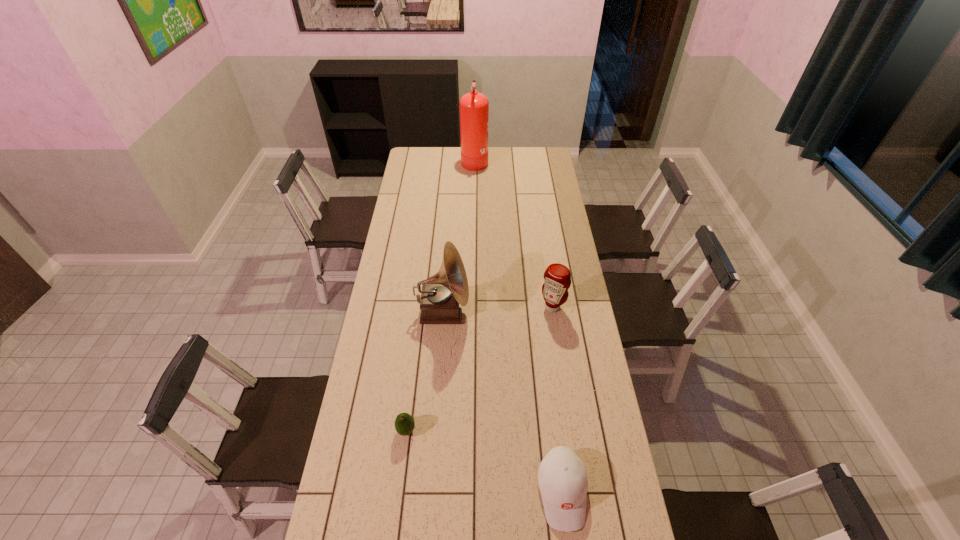
In order to click on object present at the far edge in this screenshot , I will do `click(474, 107)`.

Locate an element on the screen. Image resolution: width=960 pixels, height=540 pixels. object situated at the left edge is located at coordinates (404, 423).

Where is `condiment that is at the right edge`? This screenshot has width=960, height=540. condiment that is at the right edge is located at coordinates (557, 278).

You are a GUI agent. You are given a task and a screenshot of the screen. Output one action in this format:
    pyautogui.click(x=<x>, y=<y>)
    Task: Click on the baseball cap located in the right edge section of the desktop
    This screenshot has width=960, height=540.
    Given the screenshot: What is the action you would take?
    pyautogui.click(x=562, y=478)

In the image, there is a desktop. Where is `free space at the left edge`? This screenshot has width=960, height=540. free space at the left edge is located at coordinates (407, 289).

At what (x,y) coordinates should I click in order to perform the action: click on free point at the right edge. Please return your answer as a coordinate pair (x, y). Looking at the image, I should click on (573, 284).

Locate an element on the screen. Image resolution: width=960 pixels, height=540 pixels. vacant space at the far right corner of the desktop is located at coordinates (553, 165).

Find the location of a particular element. Image resolution: width=960 pixels, height=540 pixels. free space between the nearest object and the fourth shortest object is located at coordinates (502, 402).

Identify the location of empty location between the phonograph record and the second nearest object. The width and height of the screenshot is (960, 540). (424, 371).

Identify the location of free space between the second nearest object and the second tallest object. (424, 371).